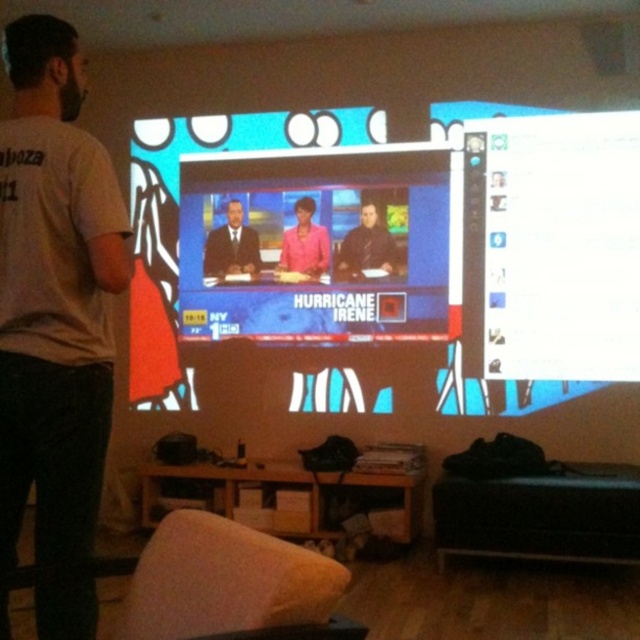
Between gray cotton t-shirt at left and white glossy screen at upper right, which one appears on the left side from the viewer's perspective?

From the viewer's perspective, gray cotton t-shirt at left appears more on the left side.

Who is more forward, (74,532) or (637,182)?

Point (74,532)

Where is `gray cotton t-shirt at left`? This screenshot has width=640, height=640. gray cotton t-shirt at left is located at coordinates (54, 296).

Is smooth suit at center below pink fabric at center?

Indeed, smooth suit at center is positioned under pink fabric at center.

Is smooth suit at center smaller than pink fabric at center?

No.

You are a GUI agent. You are given a task and a screenshot of the screen. Output one action in this format:
    pyautogui.click(x=<x>, y=<y>)
    Task: Click on the smooth suit at center
    Image resolution: width=640 pixels, height=640 pixels.
    Given the screenshot: What is the action you would take?
    pyautogui.click(x=230, y=246)

Can you confirm if gray cotton t-shirt at left is positioned to the right of pink fabric at center?

No, gray cotton t-shirt at left is not to the right of pink fabric at center.

Does gray cotton t-shirt at left have a greater width compared to pink fabric at center?

Yes.

At what (x,y) coordinates should I click in order to perform the action: click on gray cotton t-shirt at left. Please return your answer as a coordinate pair (x, y). Image resolution: width=640 pixels, height=640 pixels. Looking at the image, I should click on (54, 296).